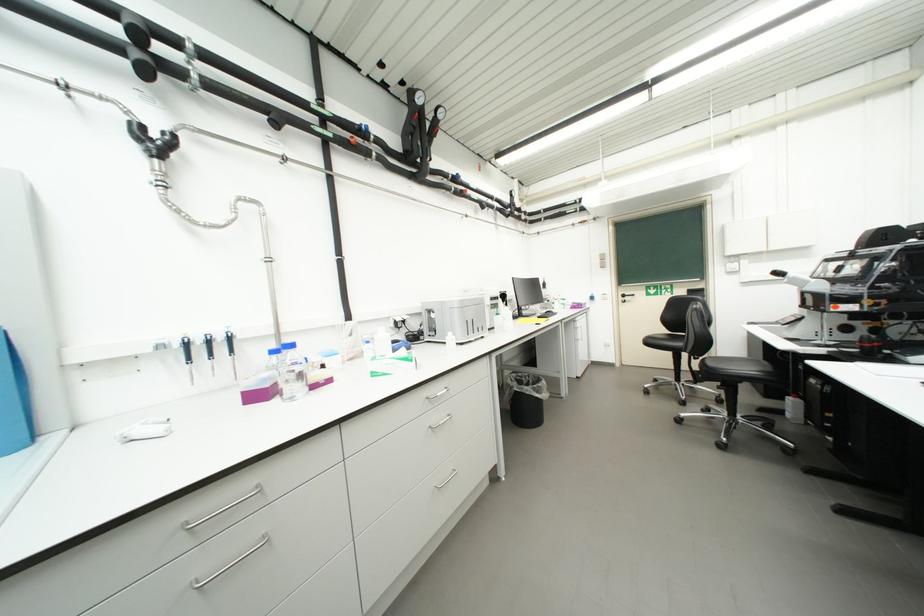
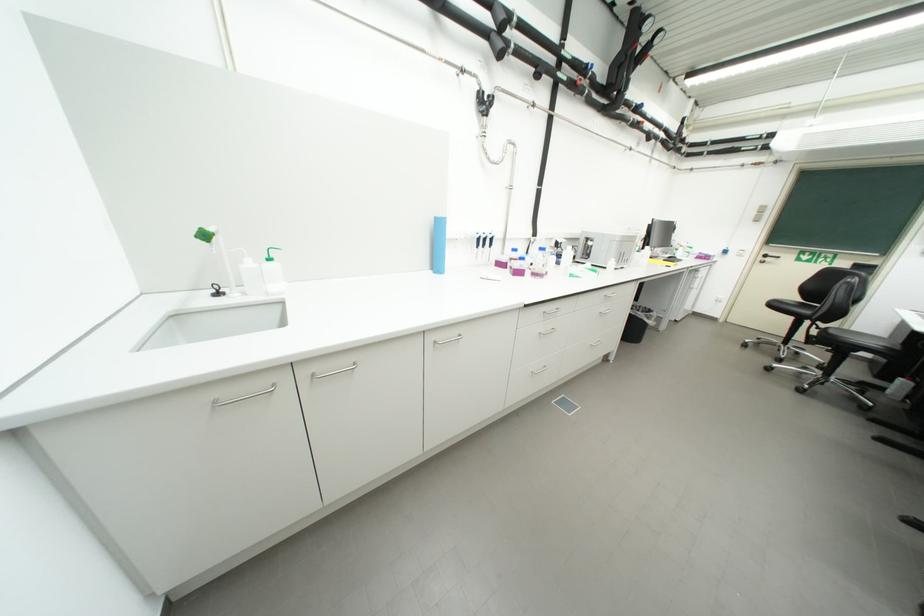
Locate, in the second image, the point that corresponds to [659,344] in the first image.

(783, 307)